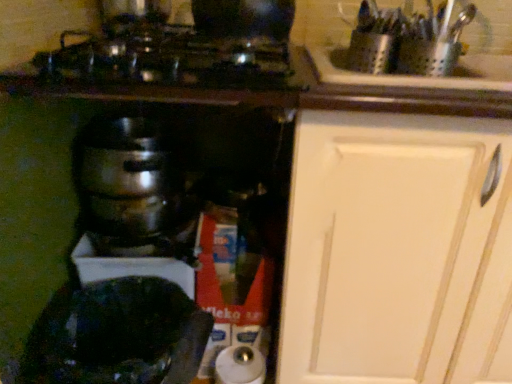
Question: Considering the relative positions of white matte cabinet at upper right and shiny metallic cookware at upper center in the image provided, is white matte cabinet at upper right to the right of shiny metallic cookware at upper center from the viewer's perspective?

Choices:
 (A) yes
 (B) no

Answer: (A)

Question: From the image's perspective, is white matte cabinet at upper right located beneath shiny metallic cookware at upper center?

Choices:
 (A) no
 (B) yes

Answer: (B)

Question: Can you confirm if white matte cabinet at upper right is positioned to the left of shiny metallic cookware at upper center?

Choices:
 (A) no
 (B) yes

Answer: (A)

Question: Would you consider white matte cabinet at upper right to be distant from shiny metallic cookware at upper center?

Choices:
 (A) no
 (B) yes

Answer: (A)

Question: Does white matte cabinet at upper right have a greater height compared to shiny metallic cookware at upper center?

Choices:
 (A) yes
 (B) no

Answer: (A)

Question: Relative to white matte cabinet at upper right, is shiny black pot at lower left in front or behind?

Choices:
 (A) front
 (B) behind

Answer: (B)

Question: Is point (136, 317) closer or farther from the camera than point (478, 233)?

Choices:
 (A) closer
 (B) farther

Answer: (B)

Question: Is shiny black pot at lower left wider or thinner than white matte cabinet at upper right?

Choices:
 (A) thin
 (B) wide

Answer: (A)

Question: Considering the positions of shiny black pot at lower left and white matte cabinet at upper right in the image, is shiny black pot at lower left taller or shorter than white matte cabinet at upper right?

Choices:
 (A) short
 (B) tall

Answer: (A)

Question: Do you think shiny metallic pot at center is within shiny black pot at lower left, or outside of it?

Choices:
 (A) outside
 (B) inside

Answer: (A)

Question: Considering their positions, is shiny metallic pot at center located in front of or behind shiny black pot at lower left?

Choices:
 (A) behind
 (B) front

Answer: (A)

Question: Would you say shiny metallic pot at center is to the left or to the right of shiny black pot at lower left in the picture?

Choices:
 (A) right
 (B) left

Answer: (B)

Question: From the image's perspective, is shiny metallic pot at center located above or below shiny black pot at lower left?

Choices:
 (A) below
 (B) above

Answer: (B)

Question: From their relative heights in the image, would you say shiny black pot at lower left is taller or shorter than shiny metallic cookware at upper center?

Choices:
 (A) short
 (B) tall

Answer: (B)

Question: In the image, is shiny black pot at lower left positioned in front of or behind shiny metallic cookware at upper center?

Choices:
 (A) behind
 (B) front

Answer: (A)